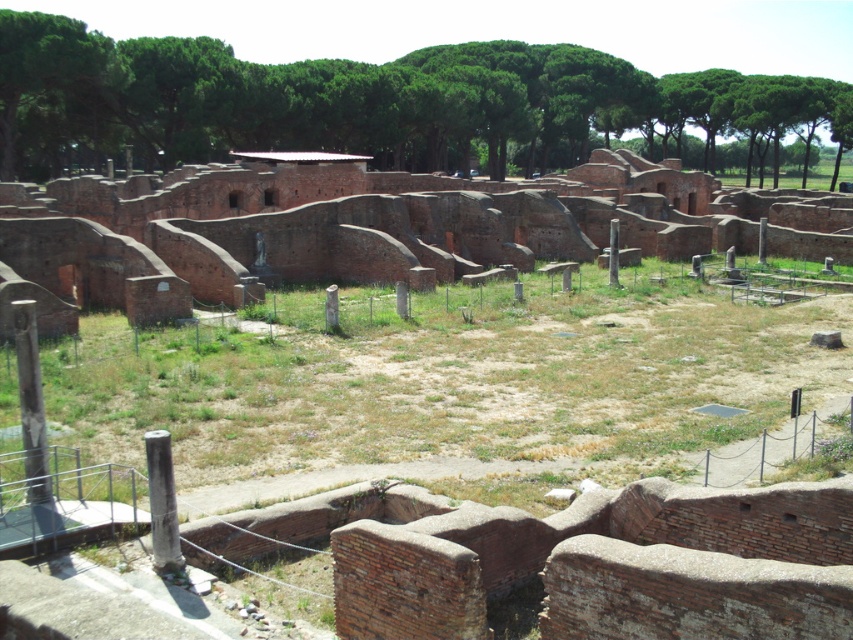
Consider the image. Between green grass at center and smooth stone pillar at lower left, which one appears on the left side from the viewer's perspective?

smooth stone pillar at lower left is more to the left.

Is green grass at center thinner than smooth stone pillar at lower left?

Incorrect, green grass at center's width is not less than smooth stone pillar at lower left's.

Between point (831, 307) and point (33, 360), which one is positioned in front?

Point (33, 360)

Identify the location of green grass at center. (445, 387).

Is point (10, 186) positioned behind point (160, 481)?

Yes, point (10, 186) is farther from viewer.

Is point (518, 221) in front of point (154, 470)?

No, (518, 221) is further to viewer.

This screenshot has width=853, height=640. In order to click on brick wall at center in this screenshot , I will do point(387,221).

Is point (788, 364) closer to viewer compared to point (248, 177)?

Yes, it is.

Between green grass at center and brick wall at center, which one is positioned higher?

brick wall at center

Is point (514, 352) farther from viewer compared to point (277, 193)?

No, (514, 352) is in front of (277, 193).

At what (x,y) coordinates should I click in order to perform the action: click on green grass at center. Please return your answer as a coordinate pair (x, y). Image resolution: width=853 pixels, height=640 pixels. Looking at the image, I should click on (445, 387).